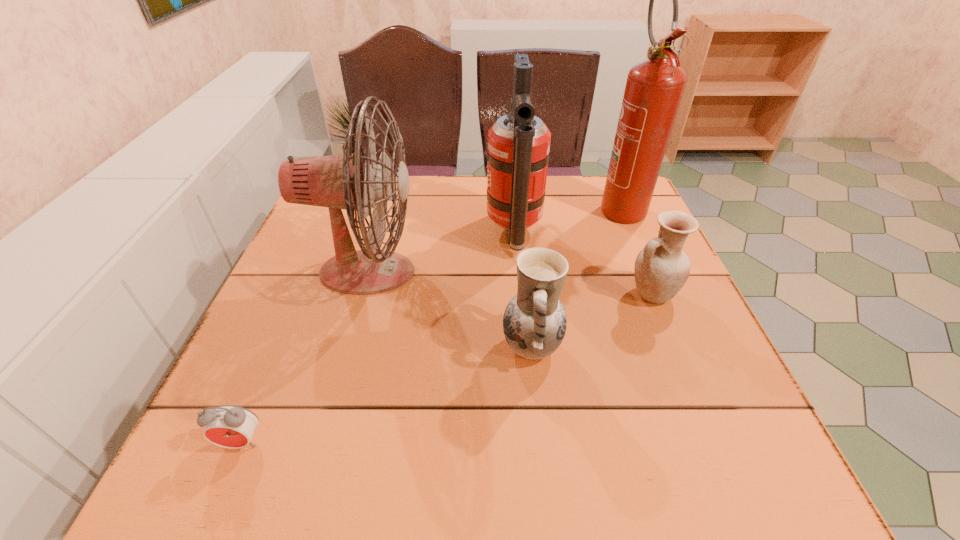
Find the location of a particular element. The image size is (960, 540). free point located on the front label side of the left fire extinguisher is located at coordinates (450, 234).

In order to click on vacant space located 0.130m on the front label side of the left fire extinguisher in this screenshot , I will do `click(434, 234)`.

You are a GUI agent. You are given a task and a screenshot of the screen. Output one action in this format:
    pyautogui.click(x=<x>, y=<y>)
    Task: Click on the blank area located in front of the fan to direct airflow
    Image resolution: width=960 pixels, height=540 pixels.
    Given the screenshot: What is the action you would take?
    [x=584, y=273]

This screenshot has width=960, height=540. In order to click on free location located 0.390m on either side of the left pottery in this screenshot , I will do `click(296, 347)`.

Locate an element on the screen. vacant space located 0.250m on either side of the left pottery is located at coordinates (370, 347).

Identify the location of vacant area situated 0.240m on either side of the left pottery. The height and width of the screenshot is (540, 960). (374, 347).

The width and height of the screenshot is (960, 540). I want to click on vacant space located on the left of the farther pottery, so click(x=491, y=294).

Find the location of a particular element. blank area located on the face of the alarm clock is located at coordinates (223, 487).

At what (x,y) coordinates should I click in order to perform the action: click on object that is at the near edge. Please return your answer as a coordinate pair (x, y). Looking at the image, I should click on tap(228, 426).

Find the location of a particular element. fan that is at the left edge is located at coordinates (340, 181).